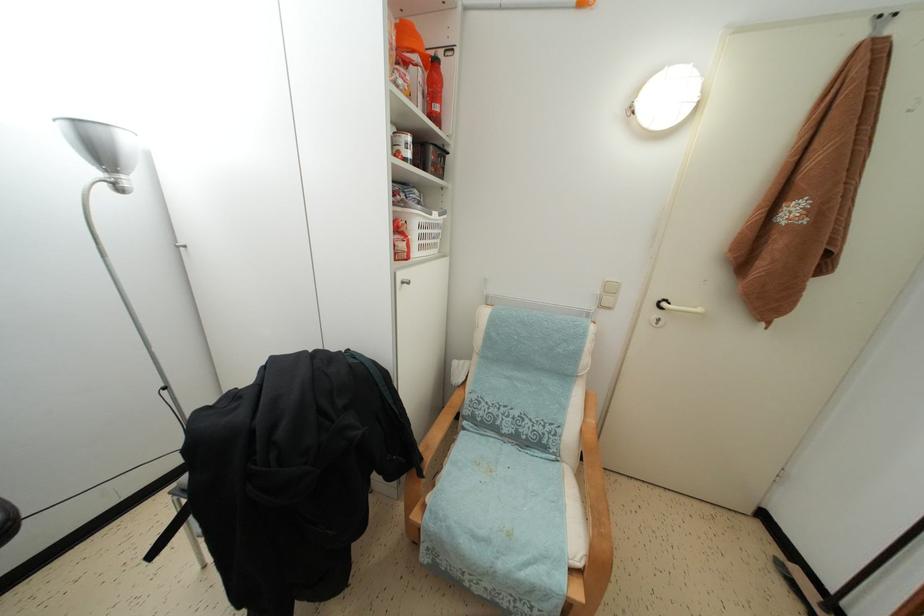
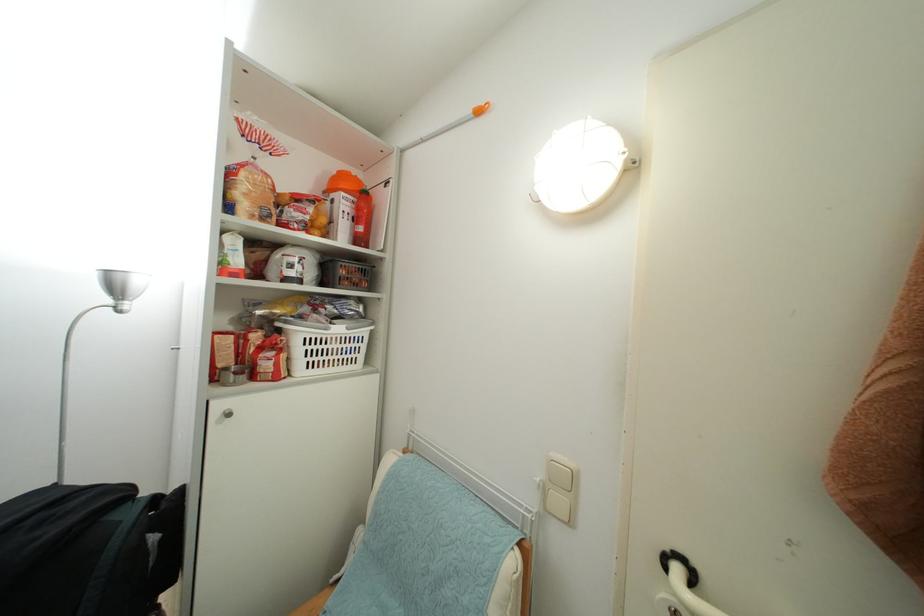
Find the pixel in the second image that matches pixel 434 220 in the first image.

(331, 334)